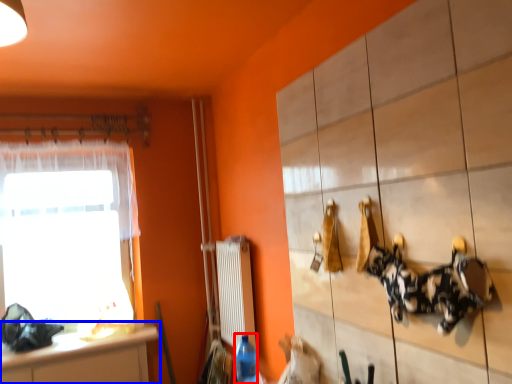
Question: Which point is closer to the camera, bottle (highlighted by a red box) or countertop (highlighted by a blue box)?

Choices:
 (A) bottle
 (B) countertop

Answer: (A)